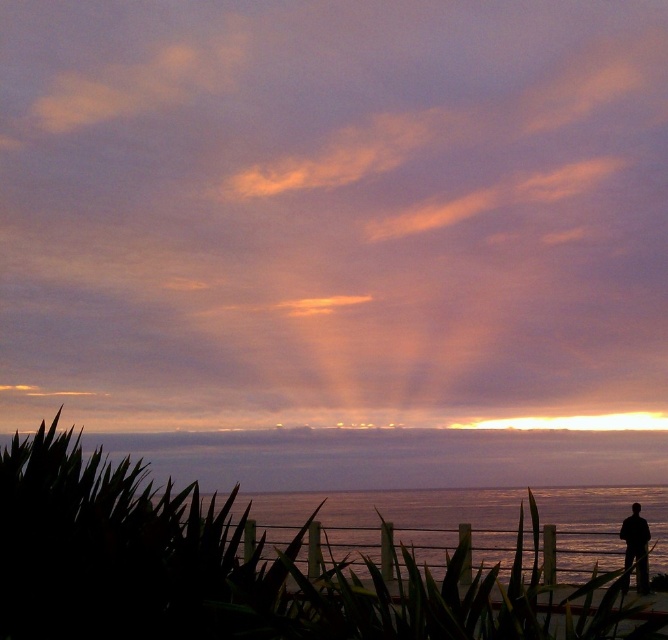
Is point (355, 508) in front of point (637, 582)?

Yes, point (355, 508) is closer to viewer.

Who is more forward, (637,486) or (645,554)?

Point (645,554)

This screenshot has width=668, height=640. What do you see at coordinates (397, 520) in the screenshot?
I see `silvery water at lower right` at bounding box center [397, 520].

Where is `silvery water at lower right`? The height and width of the screenshot is (640, 668). silvery water at lower right is located at coordinates (397, 520).

From the picture: Can you confirm if purple matte cloud at upper center is wider than silhouette figure at lower right?

Indeed, purple matte cloud at upper center has a greater width compared to silhouette figure at lower right.

Does point (174, 320) lie in front of point (631, 547)?

Yes, it is.

Measure the distance between purple matte cloud at upper center and camera.

purple matte cloud at upper center is 5.30 meters from camera.

Find the location of `purple matte cloud at upper center`. purple matte cloud at upper center is located at coordinates (333, 212).

Which of these two, purple matte cloud at upper center or silvery water at lower right, stands taller?

purple matte cloud at upper center is taller.

Which is in front, point (357, 20) or point (295, 525)?

Point (357, 20)

Locate an element on the screen. purple matte cloud at upper center is located at coordinates (333, 212).